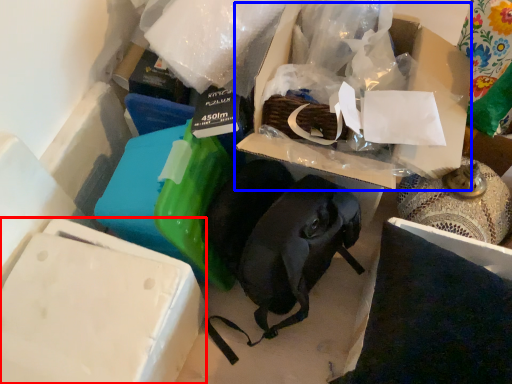
Question: Which object appears farthest to the camera in this image, box (highlighted by a red box) or storage box (highlighted by a blue box)?

Choices:
 (A) box
 (B) storage box

Answer: (B)